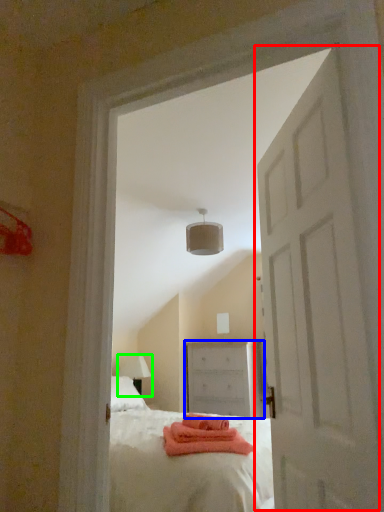
Question: Which object is positioned farthest from door (highlighted by a red box)? Select from chest of drawers (highlighted by a blue box) and table lamp (highlighted by a green box).

Choices:
 (A) chest of drawers
 (B) table lamp

Answer: (B)